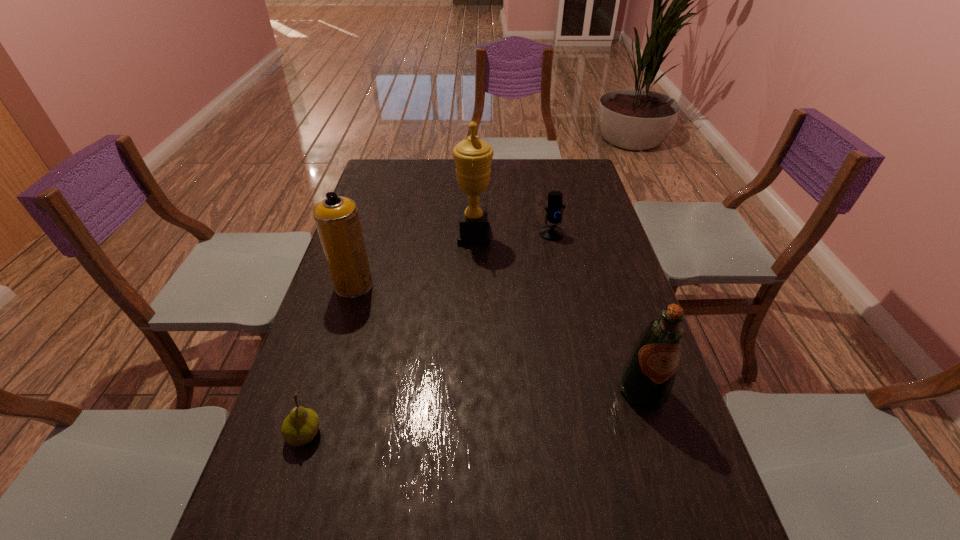
Where is `vacant area situated on the right of the third nearest object`? vacant area situated on the right of the third nearest object is located at coordinates (420, 285).

The height and width of the screenshot is (540, 960). What are the coordinates of `free point located on the front-facing side of the fourth farthest object` in the screenshot? It's located at (664, 460).

You are a GUI agent. You are given a task and a screenshot of the screen. Output one action in this format:
    pyautogui.click(x=<x>, y=<y>)
    Task: Click on the vacant space situated 0.230m on the stand of the microphone
    
    Given the screenshot: What is the action you would take?
    pyautogui.click(x=563, y=288)

Identify the location of vacant space located 0.070m on the front of the shortest object. (288, 485).

I want to click on aerosol can situated at the left edge, so click(337, 220).

Locate an element on the screen. Image resolution: width=960 pixels, height=540 pixels. pear positioned at the left edge is located at coordinates (300, 427).

Image resolution: width=960 pixels, height=540 pixels. What are the coordinates of `object that is at the right edge` in the screenshot? It's located at (647, 378).

The image size is (960, 540). Identify the location of vacant space at the far edge. (x=448, y=183).

You are a GUI agent. You are given a task and a screenshot of the screen. Output one action in this format:
    pyautogui.click(x=<x>, y=<y>)
    Task: Click on the vacant space at the left edge
    The image size is (960, 540).
    Given the screenshot: What is the action you would take?
    pyautogui.click(x=361, y=302)

Where is `vacant region at the right edge`? This screenshot has width=960, height=540. vacant region at the right edge is located at coordinates (662, 435).